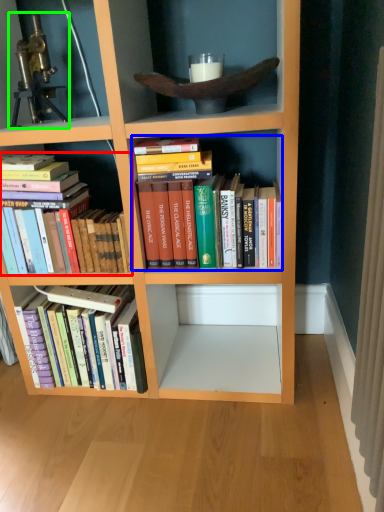
Question: Estimate the real-world distances between objects in this image. Which object is closer to book (highlighted by a red box), book (highlighted by a blue box) or telescope (highlighted by a green box)?

Choices:
 (A) book
 (B) telescope

Answer: (A)